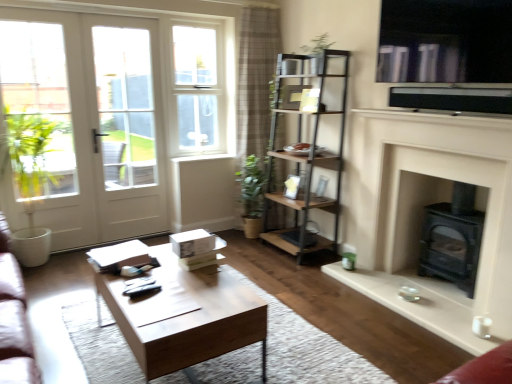
Image resolution: width=512 pixels, height=384 pixels. Identify the location of free space above white glass screen door at left (from a real-world perspective). (120, 19).